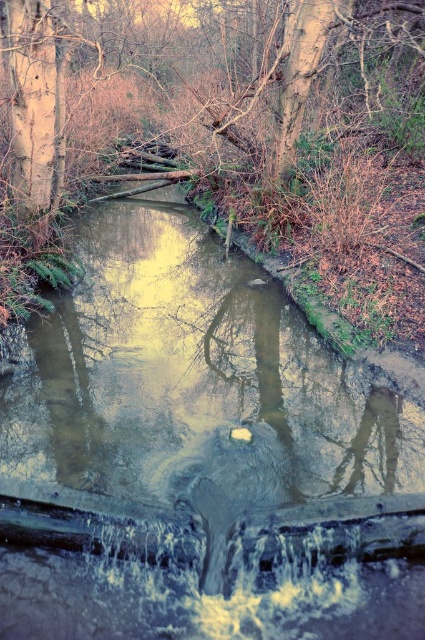
Who is shorter, brown concrete at center or brown wood tree at upper center?

With less height is brown concrete at center.

From the picture: Does brown concrete at center appear over brown wood tree at upper center?

No.

Does point (172, 618) come behind point (237, 161)?

No, (172, 618) is closer to viewer.

Identify the location of brown concrete at center. (195, 438).